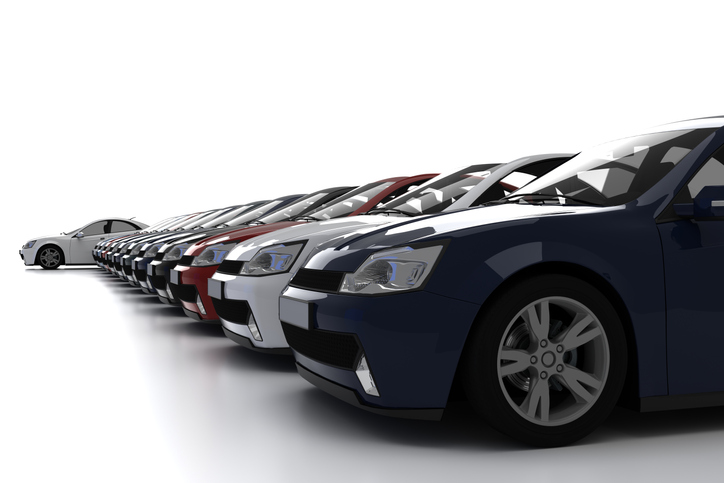
Where is `hood`? This screenshot has height=483, width=724. hood is located at coordinates (420, 233), (251, 227), (295, 234), (214, 228), (185, 228), (156, 235), (146, 234), (135, 234), (127, 233).